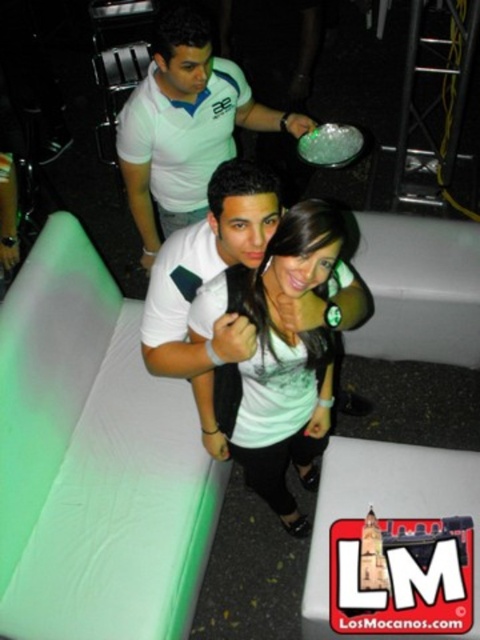
Between white matte shirt at center and white matte shirt at upper center, which one is positioned lower?

white matte shirt at center is lower down.

Locate an element on the screen. This screenshot has width=480, height=640. white matte shirt at center is located at coordinates (277, 360).

I want to click on white matte shirt at center, so click(x=277, y=360).